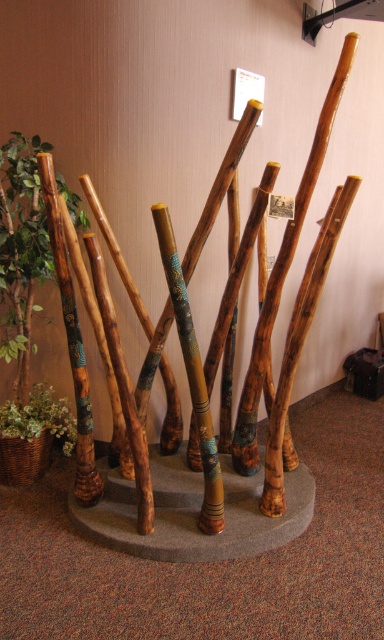
You are standing in front of the display of walking sticks and notice a green leafy plant at left and a wooden painted staff at center. Which object is positioned further to the left?

The green leafy plant at left is positioned further to the left compared to the wooden painted staff at center.

You are an interior designer arranging items in a room. You have a green leafy plant at left and a wooden painted staff at center. According to the scene, which object is placed above the other?

The green leafy plant at left is positioned over wooden painted staff at center, so the plant is placed above the staff.